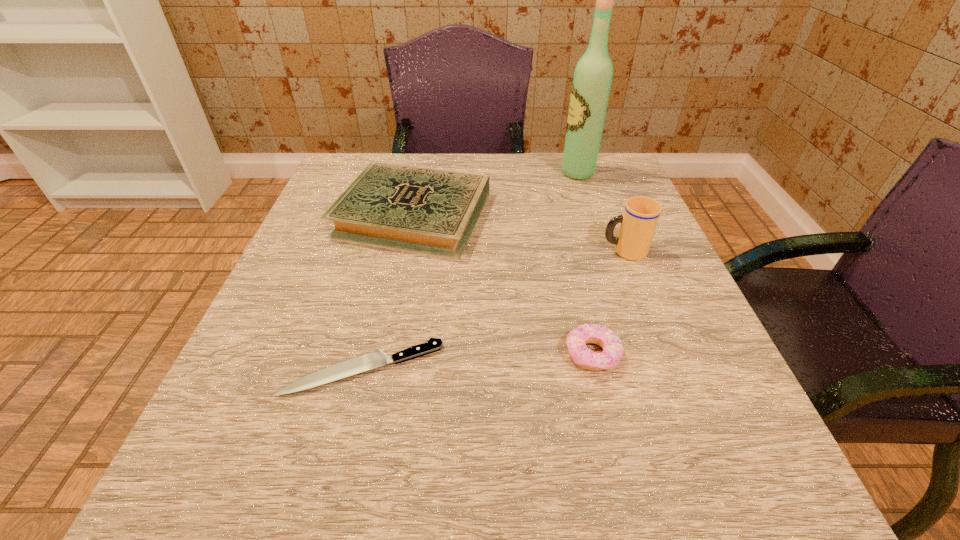
At what (x,y) coordinates should I click in order to perform the action: click on free space that is in between the shortest object and the fourth tallest object. Please return your answer as a coordinate pair (x, y). This screenshot has width=960, height=540. Looking at the image, I should click on (478, 361).

Where is `free point between the third tallest object and the wine bottle`? The image size is (960, 540). free point between the third tallest object and the wine bottle is located at coordinates pyautogui.click(x=495, y=194).

Image resolution: width=960 pixels, height=540 pixels. Find the location of `vacant space in between the hardback book and the fourth shortest object`. vacant space in between the hardback book and the fourth shortest object is located at coordinates (518, 233).

Find the location of a particular element. This screenshot has width=960, height=540. free spot between the cup and the steak knife is located at coordinates (493, 310).

Locate an element on the screen. The height and width of the screenshot is (540, 960). free space between the fourth shortest object and the wine bottle is located at coordinates (601, 212).

This screenshot has height=540, width=960. I want to click on empty space that is in between the cup and the second shortest object, so click(x=609, y=303).

Identify the location of vacant space in between the steak knife and the hardback book. This screenshot has width=960, height=540. pyautogui.click(x=388, y=292).

Identify the location of free space between the hardback book and the tallest object. The width and height of the screenshot is (960, 540). (495, 194).

Locate an element on the screen. vacant area that lies between the second shortest object and the wine bottle is located at coordinates (585, 264).

Image resolution: width=960 pixels, height=540 pixels. Find the location of `object that stands as the second closest to the tallest object`. object that stands as the second closest to the tallest object is located at coordinates (639, 220).